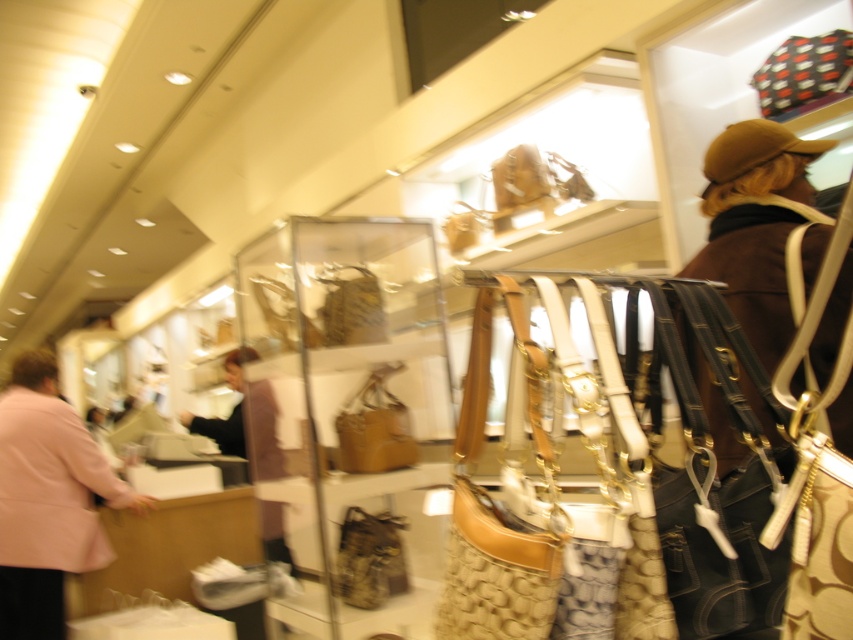
Question: Which point is closer to the camera?

Choices:
 (A) leather bag at center
 (B) matte brown leather handbag at center

Answer: (A)

Question: Among these points, which one is farthest from the camera?

Choices:
 (A) (97, 552)
 (B) (405, 448)
 (C) (363, 572)

Answer: (A)

Question: Is pink fabric coat at left closer to camera compared to matte brown leather handbag at center?

Choices:
 (A) yes
 (B) no

Answer: (B)

Question: Estimate the real-world distances between objects in this image. Which object is closer to the leather bag at center?

Choices:
 (A) pink fabric coat at left
 (B) matte brown leather handbag at center

Answer: (B)

Question: Is pink fabric coat at left positioned at the back of matte brown leather handbag at center?

Choices:
 (A) yes
 (B) no

Answer: (A)

Question: Does pink fabric coat at left have a lesser width compared to leather bag at center?

Choices:
 (A) yes
 (B) no

Answer: (B)